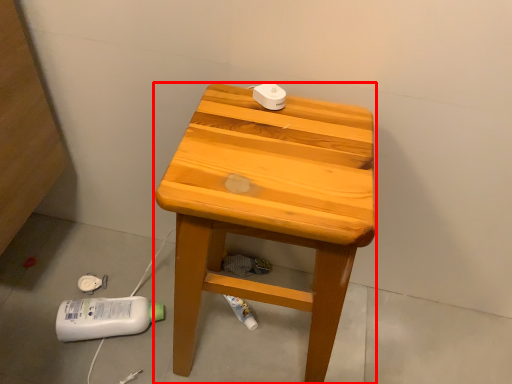
Question: Observing the image, what is the correct spatial positioning of stool (annotated by the red box) in reference to concrete?

Choices:
 (A) left
 (B) right

Answer: (B)